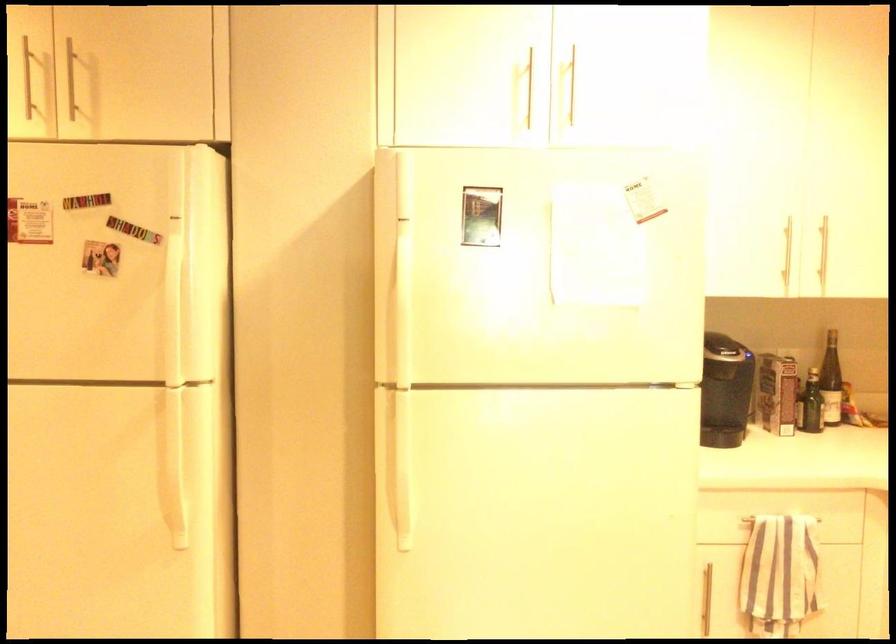
Find where to lift the cardboard carton. Please return your answer as a coordinate pair (x, y).

(777, 393)